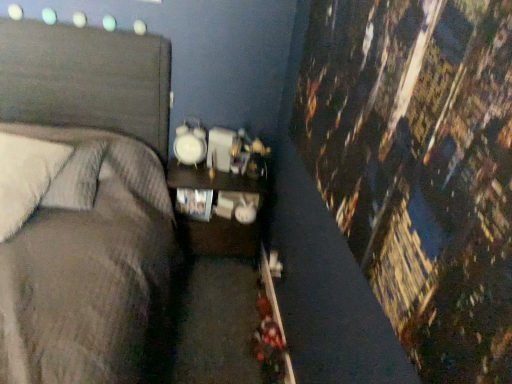
Image resolution: width=512 pixels, height=384 pixels. What do you see at coordinates (220, 215) in the screenshot? I see `matte wood nightstand at center` at bounding box center [220, 215].

Locate an element on the screen. The image size is (512, 384). white soft pillow at left, the first pillow positioned from the front is located at coordinates (26, 177).

Is white soft pillow at left, the first pillow positioned from the front, shorter than white soft pillow at left, which ranks as the 1th pillow in back-to-front order?

No, white soft pillow at left, the first pillow positioned from the front, is not shorter than white soft pillow at left, which ranks as the 1th pillow in back-to-front order.

From the image's perspective, is white soft pillow at left, the first pillow positioned from the front, located beneath white soft pillow at left, which ranks as the 1th pillow in back-to-front order?

Yes.

In terms of size, does white soft pillow at left, the second pillow positioned from the back, appear bigger or smaller than white soft pillow at left, which ranks as the 1th pillow in back-to-front order?

white soft pillow at left, the second pillow positioned from the back, is bigger than white soft pillow at left, which ranks as the 1th pillow in back-to-front order.

Is white soft pillow at left, the first pillow positioned from the front, facing towards white soft pillow at left, which ranks as the 1th pillow in back-to-front order?

Yes, white soft pillow at left, the first pillow positioned from the front, is turned towards white soft pillow at left, which ranks as the 1th pillow in back-to-front order.

Is white soft pillow at left, the 2th pillow from the front, at the back of matte wood nightstand at center?

No, matte wood nightstand at center's orientation is not away from white soft pillow at left, the 2th pillow from the front.

In the scene shown: Can you confirm if matte wood nightstand at center is shorter than white soft pillow at left, the 2th pillow from the front?

No, matte wood nightstand at center is not shorter than white soft pillow at left, the 2th pillow from the front.

Is matte wood nightstand at center next to white soft pillow at left, which ranks as the 1th pillow in back-to-front order?

No, matte wood nightstand at center is not in contact with white soft pillow at left, which ranks as the 1th pillow in back-to-front order.

Which point is more distant from viewer, (234,234) or (70,166)?

The point (234,234) is farther from the camera.

Can you confirm if white soft pillow at left, which ranks as the 1th pillow in back-to-front order, is positioned to the left of matte wood nightstand at center?

Yes.

Considering the relative sizes of white soft pillow at left, the 2th pillow from the front, and matte wood nightstand at center in the image provided, is white soft pillow at left, the 2th pillow from the front, bigger than matte wood nightstand at center?

Incorrect, white soft pillow at left, the 2th pillow from the front, is not larger than matte wood nightstand at center.

Could you measure the distance between white soft pillow at left, which ranks as the 1th pillow in back-to-front order, and matte wood nightstand at center?

white soft pillow at left, which ranks as the 1th pillow in back-to-front order, and matte wood nightstand at center are 26.82 inches apart from each other.

Considering the positions of objects white soft pillow at left, which ranks as the 1th pillow in back-to-front order, and matte wood nightstand at center in the image provided, who is in front, white soft pillow at left, which ranks as the 1th pillow in back-to-front order, or matte wood nightstand at center?

white soft pillow at left, which ranks as the 1th pillow in back-to-front order, is in front.

Looking at their sizes, would you say white soft pillow at left, the second pillow positioned from the back, is wider or thinner than matte wood nightstand at center?

In the image, white soft pillow at left, the second pillow positioned from the back, appears to be wider than matte wood nightstand at center.

Can you confirm if white soft pillow at left, the first pillow positioned from the front, is positioned to the right of matte wood nightstand at center?

In fact, white soft pillow at left, the first pillow positioned from the front, is to the left of matte wood nightstand at center.

Looking at this image, who is taller, white soft pillow at left, the second pillow positioned from the back, or matte wood nightstand at center?

matte wood nightstand at center.

Does matte wood nightstand at center have a lesser width compared to white soft pillow at left, the second pillow positioned from the back?

Yes, matte wood nightstand at center is thinner than white soft pillow at left, the second pillow positioned from the back.

From a real-world perspective, is matte wood nightstand at center above or below white soft pillow at left, the first pillow positioned from the front?

matte wood nightstand at center is below white soft pillow at left, the first pillow positioned from the front.

Measure the distance from matte wood nightstand at center to white soft pillow at left, the first pillow positioned from the front.

matte wood nightstand at center and white soft pillow at left, the first pillow positioned from the front, are 83.12 centimeters apart from each other.

Considering the sizes of objects matte wood nightstand at center and white soft pillow at left, the second pillow positioned from the back, in the image provided, who is shorter, matte wood nightstand at center or white soft pillow at left, the second pillow positioned from the back,?

With less height is white soft pillow at left, the second pillow positioned from the back.

Is white soft pillow at left, which ranks as the 1th pillow in back-to-front order, inside the boundaries of white soft pillow at left, the first pillow positioned from the front, or outside?

white soft pillow at left, which ranks as the 1th pillow in back-to-front order, is spatially positioned inside white soft pillow at left, the first pillow positioned from the front.

Looking at this image, which is more to the right, white soft pillow at left, the 2th pillow from the front, or white soft pillow at left, the first pillow positioned from the front?

From the viewer's perspective, white soft pillow at left, the 2th pillow from the front, appears more on the right side.

Is white soft pillow at left, which ranks as the 1th pillow in back-to-front order, in front of or behind white soft pillow at left, the second pillow positioned from the back, in the image?

white soft pillow at left, which ranks as the 1th pillow in back-to-front order, is behind white soft pillow at left, the second pillow positioned from the back.

From a real-world perspective, is white soft pillow at left, which ranks as the 1th pillow in back-to-front order, on white soft pillow at left, the first pillow positioned from the front?

Correct, in the physical world, white soft pillow at left, which ranks as the 1th pillow in back-to-front order, is higher than white soft pillow at left, the first pillow positioned from the front.

Locate an element on the screen. The width and height of the screenshot is (512, 384). pillow in front of the white soft pillow at left, which ranks as the 1th pillow in back-to-front order is located at coordinates (26, 177).

At what (x,y) coordinates should I click in order to perform the action: click on nightstand on the right of white soft pillow at left, the 2th pillow from the front. Please return your answer as a coordinate pair (x, y). The height and width of the screenshot is (384, 512). Looking at the image, I should click on (220, 215).

In the scene shown: When comparing their distances from white soft pillow at left, which ranks as the 1th pillow in back-to-front order, does white soft pillow at left, the second pillow positioned from the back, or matte wood nightstand at center seem closer?

white soft pillow at left, the second pillow positioned from the back, is positioned closer to the anchor white soft pillow at left, which ranks as the 1th pillow in back-to-front order.

Considering their positions, is matte wood nightstand at center positioned further to white soft pillow at left, the 2th pillow from the front, than white soft pillow at left, the first pillow positioned from the front?

The object further to white soft pillow at left, the 2th pillow from the front, is matte wood nightstand at center.

Estimate the real-world distances between objects in this image. Which object is closer to matte wood nightstand at center, white soft pillow at left, which ranks as the 1th pillow in back-to-front order, or white soft pillow at left, the first pillow positioned from the front?

The object closer to matte wood nightstand at center is white soft pillow at left, which ranks as the 1th pillow in back-to-front order.

When comparing their distances from matte wood nightstand at center, does white soft pillow at left, the first pillow positioned from the front, or white soft pillow at left, the 2th pillow from the front, seem closer?

white soft pillow at left, the 2th pillow from the front, is positioned closer to the anchor matte wood nightstand at center.

From the image, which object appears to be nearer to white soft pillow at left, the first pillow positioned from the front, matte wood nightstand at center or white soft pillow at left, the 2th pillow from the front?

white soft pillow at left, the 2th pillow from the front, is positioned closer to the anchor white soft pillow at left, the first pillow positioned from the front.

Which object lies further to the anchor point white soft pillow at left, the first pillow positioned from the front, white soft pillow at left, which ranks as the 1th pillow in back-to-front order, or matte wood nightstand at center?

matte wood nightstand at center is further to white soft pillow at left, the first pillow positioned from the front.

This screenshot has height=384, width=512. What are the coordinates of `pillow between white soft pillow at left, the first pillow positioned from the front, and matte wood nightstand at center from left to right` in the screenshot? It's located at (77, 179).